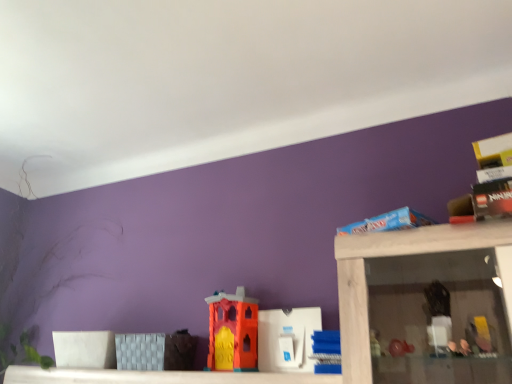
Question: Is orange matte plastic castle at center, marked as the 3th toy in a right-to-left arrangement, located outside white plastic toy at center, which is the second toy in left-to-right order?

Choices:
 (A) yes
 (B) no

Answer: (A)

Question: Can you confirm if orange matte plastic castle at center, marked as the 3th toy in a right-to-left arrangement, is positioned to the left of white plastic toy at center, which is the second toy in right-to-left order?

Choices:
 (A) no
 (B) yes

Answer: (B)

Question: From the image's perspective, does orange matte plastic castle at center, placed as the first toy when sorted from left to right, appear higher than white plastic toy at center, which is the second toy in right-to-left order?

Choices:
 (A) yes
 (B) no

Answer: (A)

Question: Is orange matte plastic castle at center, placed as the first toy when sorted from left to right, smaller than white plastic toy at center, which is the second toy in left-to-right order?

Choices:
 (A) no
 (B) yes

Answer: (A)

Question: Is orange matte plastic castle at center, placed as the first toy when sorted from left to right, bigger than white plastic toy at center, which is the second toy in left-to-right order?

Choices:
 (A) yes
 (B) no

Answer: (A)

Question: Is blue plastic blocks at center, which is the 3th toy from left to right, in front of or behind white plastic toy at center, which is the second toy in right-to-left order, in the image?

Choices:
 (A) front
 (B) behind

Answer: (A)

Question: From a real-world perspective, is blue plastic blocks at center, which is the 3th toy from left to right, physically located above or below white plastic toy at center, which is the second toy in right-to-left order?

Choices:
 (A) below
 (B) above

Answer: (A)

Question: In terms of width, does blue plastic blocks at center, the first toy viewed from the right, look wider or thinner when compared to white plastic toy at center, which is the second toy in right-to-left order?

Choices:
 (A) wide
 (B) thin

Answer: (A)

Question: Which is correct: blue plastic blocks at center, which is the 3th toy from left to right, is inside white plastic toy at center, which is the second toy in left-to-right order, or outside of it?

Choices:
 (A) outside
 (B) inside

Answer: (A)

Question: Considering the positions of orange matte plastic castle at center, marked as the 3th toy in a right-to-left arrangement, and blue plastic blocks at center, the first toy viewed from the right, in the image, is orange matte plastic castle at center, marked as the 3th toy in a right-to-left arrangement, bigger or smaller than blue plastic blocks at center, the first toy viewed from the right,?

Choices:
 (A) small
 (B) big

Answer: (B)

Question: Considering the positions of orange matte plastic castle at center, marked as the 3th toy in a right-to-left arrangement, and blue plastic blocks at center, the first toy viewed from the right, in the image, is orange matte plastic castle at center, marked as the 3th toy in a right-to-left arrangement, wider or thinner than blue plastic blocks at center, the first toy viewed from the right,?

Choices:
 (A) wide
 (B) thin

Answer: (B)

Question: Considering the relative positions of orange matte plastic castle at center, marked as the 3th toy in a right-to-left arrangement, and blue plastic blocks at center, the first toy viewed from the right, in the image provided, is orange matte plastic castle at center, marked as the 3th toy in a right-to-left arrangement, to the left or to the right of blue plastic blocks at center, the first toy viewed from the right,?

Choices:
 (A) left
 (B) right

Answer: (A)

Question: From the image's perspective, is orange matte plastic castle at center, placed as the first toy when sorted from left to right, located above or below blue plastic blocks at center, which is the 3th toy from left to right?

Choices:
 (A) below
 (B) above

Answer: (A)

Question: Visually, is white plastic toy at center, which is the second toy in right-to-left order, positioned to the left or to the right of orange matte plastic castle at center, marked as the 3th toy in a right-to-left arrangement?

Choices:
 (A) left
 (B) right

Answer: (B)

Question: In terms of width, does white plastic toy at center, which is the second toy in left-to-right order, look wider or thinner when compared to orange matte plastic castle at center, marked as the 3th toy in a right-to-left arrangement?

Choices:
 (A) wide
 (B) thin

Answer: (B)